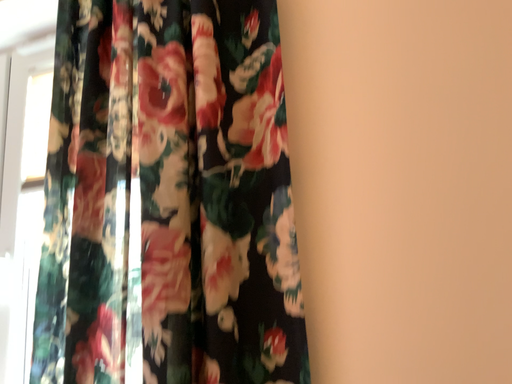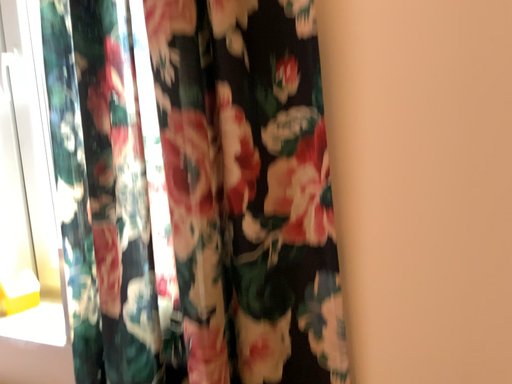
Question: How did the camera likely rotate when shooting the video?

Choices:
 (A) rotated upward
 (B) rotated downward

Answer: (B)